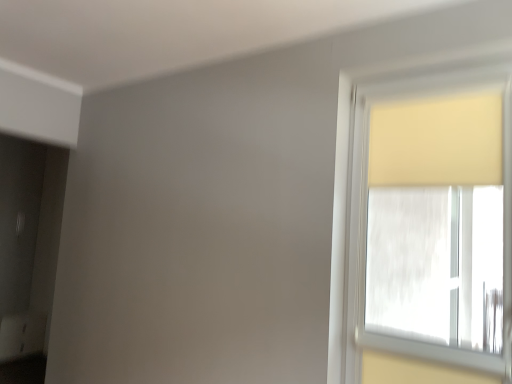
What is the approximate width of beige fabric curtain at upper right?

beige fabric curtain at upper right is 7.26 centimeters in width.

This screenshot has width=512, height=384. I want to click on beige fabric curtain at upper right, so click(x=437, y=141).

Describe the element at coordinates (437, 141) in the screenshot. I see `beige fabric curtain at upper right` at that location.

Measure the distance between point (431,170) and camera.

They are 6.99 feet apart.

Describe the element at coordinates (432, 219) in the screenshot. The height and width of the screenshot is (384, 512). I see `matte yellow curtain at right` at that location.

Measure the distance between point (403, 253) and camera.

A distance of 3.15 meters exists between point (403, 253) and camera.

This screenshot has width=512, height=384. Find the location of `matte yellow curtain at right`. matte yellow curtain at right is located at coordinates (432, 219).

Locate an element on the screen. This screenshot has height=384, width=512. beige fabric curtain at upper right is located at coordinates (437, 141).

In the scene shown: Is matte yellow curtain at right to the left of beige fabric curtain at upper right from the viewer's perspective?

Yes, matte yellow curtain at right is to the left of beige fabric curtain at upper right.

Considering their positions, is matte yellow curtain at right located in front of or behind beige fabric curtain at upper right?

matte yellow curtain at right is positioned closer to the viewer than beige fabric curtain at upper right.

Is point (472, 145) positioned after point (463, 142)?

No.

From the image's perspective, is matte yellow curtain at right on beige fabric curtain at upper right?

Incorrect, from the image's perspective, matte yellow curtain at right is lower than beige fabric curtain at upper right.

From a real-world perspective, does matte yellow curtain at right stand above beige fabric curtain at upper right?

Incorrect, from a real-world perspective, matte yellow curtain at right is lower than beige fabric curtain at upper right.

Considering the sizes of objects matte yellow curtain at right and beige fabric curtain at upper right in the image provided, who is thinner, matte yellow curtain at right or beige fabric curtain at upper right?

beige fabric curtain at upper right is thinner.

Considering the sizes of objects matte yellow curtain at right and beige fabric curtain at upper right in the image provided, who is taller, matte yellow curtain at right or beige fabric curtain at upper right?

With more height is matte yellow curtain at right.

Considering the relative sizes of matte yellow curtain at right and beige fabric curtain at upper right in the image provided, is matte yellow curtain at right smaller than beige fabric curtain at upper right?

Incorrect, matte yellow curtain at right is not smaller in size than beige fabric curtain at upper right.

Do you think matte yellow curtain at right is within beige fabric curtain at upper right, or outside of it?

matte yellow curtain at right is located beyond the bounds of beige fabric curtain at upper right.

Are matte yellow curtain at right and beige fabric curtain at upper right located far from each other?

That's not correct — matte yellow curtain at right is a little close to beige fabric curtain at upper right.

Does matte yellow curtain at right turn towards beige fabric curtain at upper right?

Yes, matte yellow curtain at right is aimed at beige fabric curtain at upper right.

What's the angular difference between matte yellow curtain at right and beige fabric curtain at upper right's facing directions?

The facing directions of matte yellow curtain at right and beige fabric curtain at upper right are 1.46 degrees apart.

Find the location of a particular element. curtain located behind the matte yellow curtain at right is located at coordinates (437, 141).

Between beige fabric curtain at upper right and matte yellow curtain at right, which one appears on the left side from the viewer's perspective?

Positioned to the left is matte yellow curtain at right.

Between beige fabric curtain at upper right and matte yellow curtain at right, which one is positioned behind?

beige fabric curtain at upper right is behind.

Between point (413, 133) and point (495, 84), which one is positioned behind?

The point (413, 133) is farther from the camera.

From the image's perspective, which object appears higher, beige fabric curtain at upper right or matte yellow curtain at right?

beige fabric curtain at upper right, from the image's perspective.

From a real-world perspective, which is physically below, beige fabric curtain at upper right or matte yellow curtain at right?

matte yellow curtain at right, from a real-world perspective.

Considering the relative sizes of beige fabric curtain at upper right and matte yellow curtain at right in the image provided, is beige fabric curtain at upper right wider than matte yellow curtain at right?

No.

Can you confirm if beige fabric curtain at upper right is shorter than matte yellow curtain at right?

Correct, beige fabric curtain at upper right is not as tall as matte yellow curtain at right.

Looking at the image, does beige fabric curtain at upper right seem bigger or smaller compared to matte yellow curtain at right?

Considering their sizes, beige fabric curtain at upper right takes up less space than matte yellow curtain at right.

Is beige fabric curtain at upper right located outside matte yellow curtain at right?

→ No, most part of beige fabric curtain at upper right lies within matte yellow curtain at right.

Is there a large distance between beige fabric curtain at upper right and matte yellow curtain at right?

beige fabric curtain at upper right is near matte yellow curtain at right, not far away.

Based on the photo, is beige fabric curtain at upper right aimed at matte yellow curtain at right?

Yes, beige fabric curtain at upper right is aimed at matte yellow curtain at right.

Where is `curtain that is above the matte yellow curtain at right (from a real-world perspective)`? The width and height of the screenshot is (512, 384). curtain that is above the matte yellow curtain at right (from a real-world perspective) is located at coordinates (437, 141).

The image size is (512, 384). I want to click on window directly beneath the beige fabric curtain at upper right (from a real-world perspective), so click(x=432, y=219).

In order to click on window that is below the beige fabric curtain at upper right (from the image's perspective) in this screenshot , I will do `click(432, 219)`.